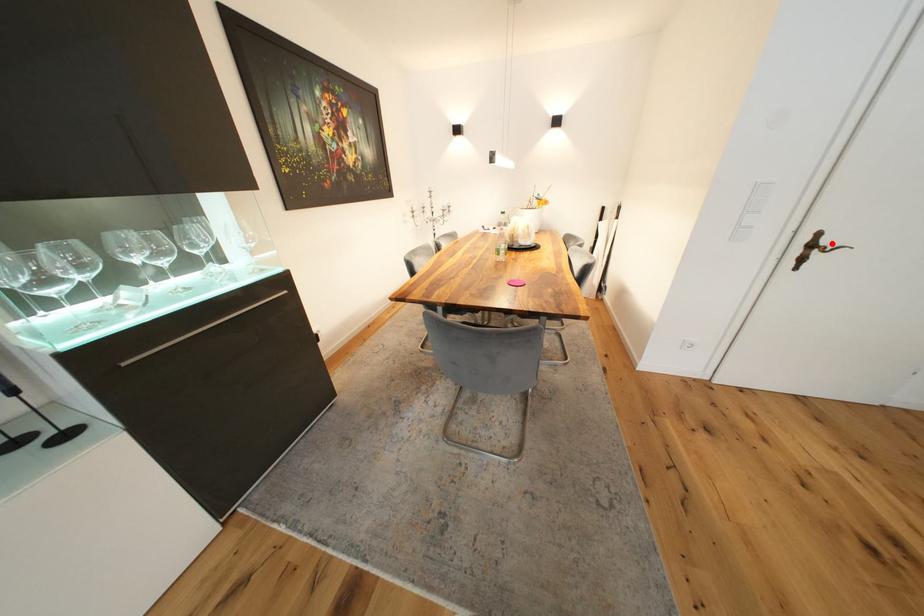
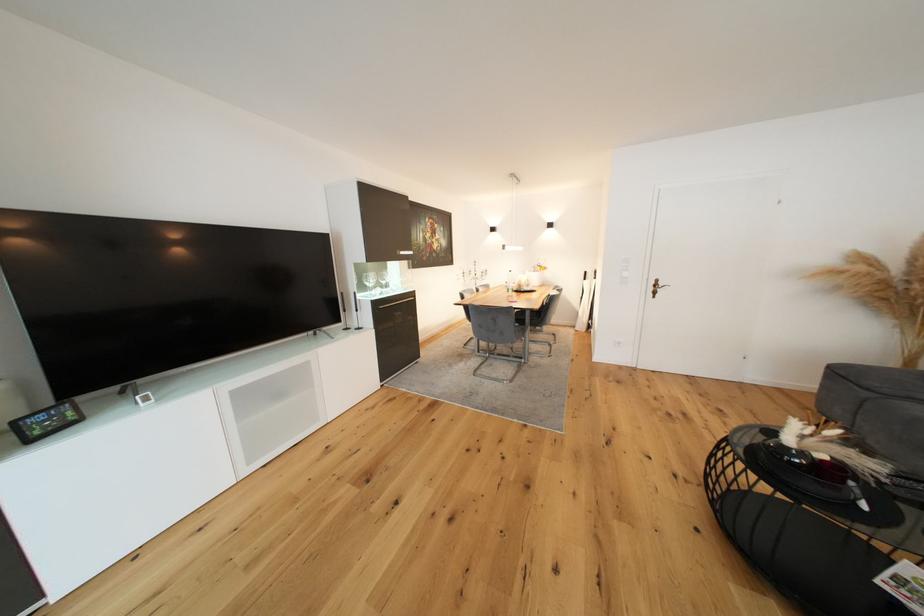
Locate, in the second image, the point that corresponds to the highlighted location in the first image.

(667, 286)